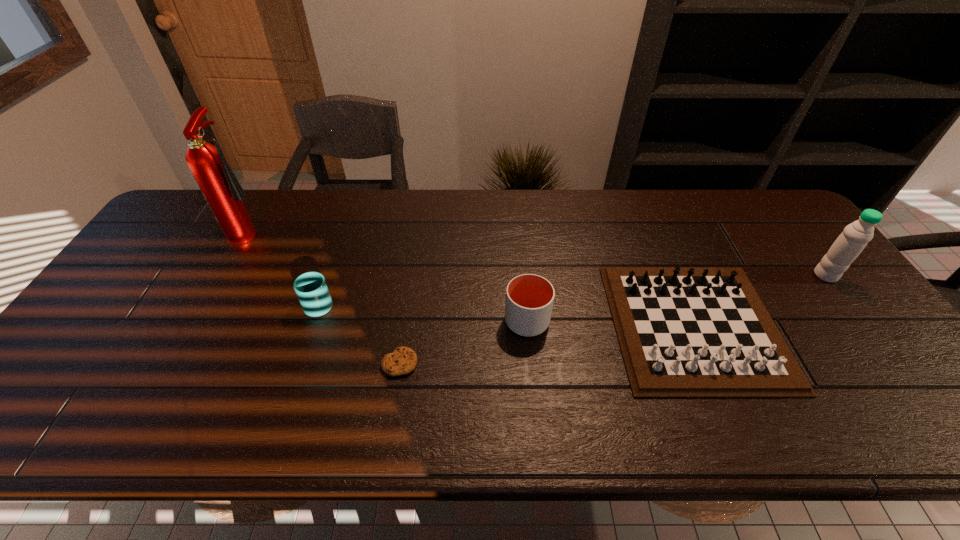
I want to click on object at the far edge, so click(220, 187).

You are a GUI agent. You are given a task and a screenshot of the screen. Output one action in this format:
    pyautogui.click(x=<x>, y=<y>)
    Task: Click on the object that is at the right edge
    The width and height of the screenshot is (960, 540).
    Given the screenshot: What is the action you would take?
    pyautogui.click(x=855, y=236)

The image size is (960, 540). What are the coordinates of `vacant space at the far edge of the desktop` in the screenshot? It's located at (280, 233).

Locate an element on the screen. The image size is (960, 540). vacant space at the near edge of the desktop is located at coordinates (269, 433).

This screenshot has height=540, width=960. What are the coordinates of `free space at the left edge` in the screenshot? It's located at (136, 268).

Locate an element on the screen. free space at the right edge is located at coordinates (875, 368).

Where is `free space at the near left corner of the desktop`? The height and width of the screenshot is (540, 960). free space at the near left corner of the desktop is located at coordinates (12, 429).

Where is `vacant region at the near right corner of the desktop`? The width and height of the screenshot is (960, 540). vacant region at the near right corner of the desktop is located at coordinates (925, 427).

Find the location of `free space between the third tallest object and the tallest object`. free space between the third tallest object and the tallest object is located at coordinates (389, 276).

Identify the location of vacant region between the third object from right to left and the tallest object. This screenshot has width=960, height=540. (389, 276).